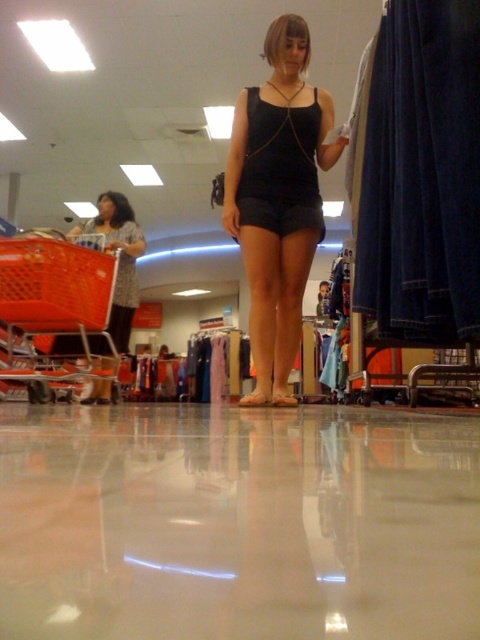
Question: Which object is the farthest from the black matte shorts at center?

Choices:
 (A) orange plastic shopping cart at left
 (B) matte brown hair at left

Answer: (B)

Question: Can you confirm if black matte shorts at center is positioned above orange plastic shopping cart at left?

Choices:
 (A) no
 (B) yes

Answer: (B)

Question: Does black matte shorts at center appear on the right side of matte brown hair at left?

Choices:
 (A) no
 (B) yes

Answer: (B)

Question: Which point appears farthest from the camera in this image?

Choices:
 (A) (91, 266)
 (B) (302, 106)
 (C) (120, 317)

Answer: (C)

Question: Is orange plastic shopping cart at left below matte brown hair at left?

Choices:
 (A) no
 (B) yes

Answer: (B)

Question: Considering the real-world distances, which object is farthest from the matte brown hair at left?

Choices:
 (A) black matte shorts at center
 (B) orange plastic shopping cart at left

Answer: (A)